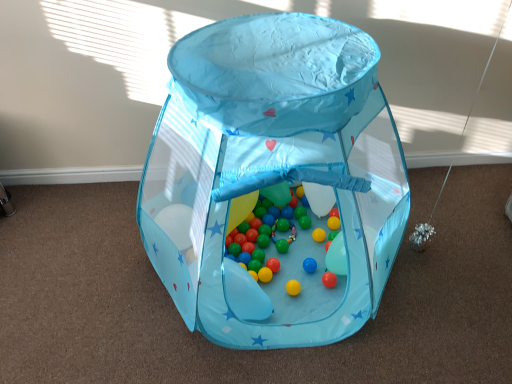
Question: Is point (397, 170) positioned closer to the camera than point (226, 226)?

Choices:
 (A) farther
 (B) closer

Answer: (A)

Question: Considering their positions, is transparent fabric play tent at center, which is the 1th toy in top-to-bottom order, located in front of or behind translucent plastic balloon at center?

Choices:
 (A) front
 (B) behind

Answer: (A)

Question: Which object is positioned farthest from the transparent fabric play tent at center, which ranks as the second toy in bottom-to-top order?

Choices:
 (A) translucent plastic balloon at center
 (B) multicolored glossy balls at center, which ranks as the first toy in bottom-to-top order

Answer: (A)

Question: Estimate the real-world distances between objects in this image. Which object is farther from the translucent plastic balloon at center?

Choices:
 (A) multicolored glossy balls at center, positioned as the 2th toy in top-to-bottom order
 (B) transparent fabric play tent at center, which is the 1th toy in top-to-bottom order

Answer: (B)